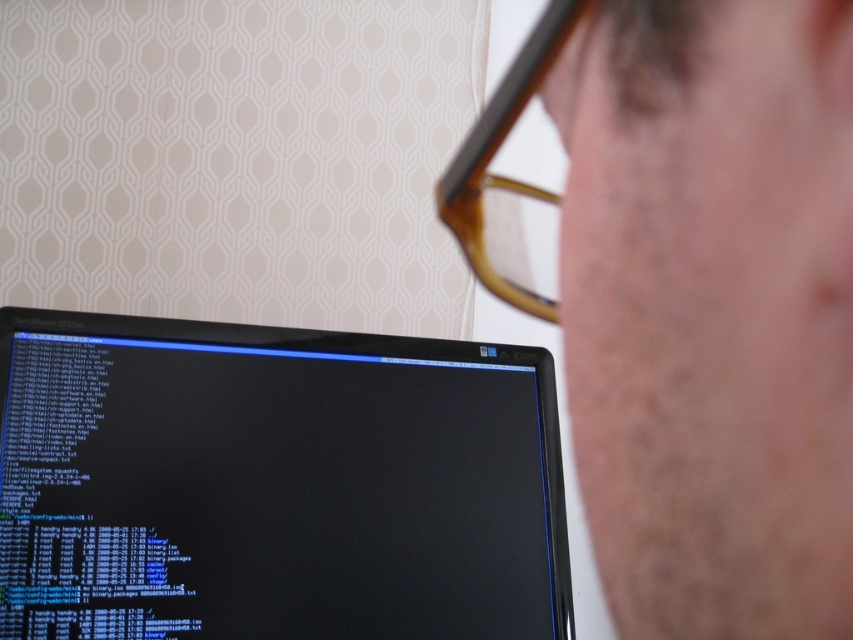
Question: Can you confirm if matte skin at center is positioned below black glossy monitor at center?

Choices:
 (A) no
 (B) yes

Answer: (A)

Question: Does black glossy monitor at center appear on the right side of brown tortoiseshell glasses at upper center?

Choices:
 (A) no
 (B) yes

Answer: (A)

Question: Among these objects, which one is farthest from the camera?

Choices:
 (A) black glossy monitor at center
 (B) matte skin at center
 (C) brown tortoiseshell glasses at upper center

Answer: (A)

Question: Does matte skin at center appear on the left side of black glossy monitor at center?

Choices:
 (A) no
 (B) yes

Answer: (A)

Question: Which point is farther from the camera taking this photo?

Choices:
 (A) (531, 305)
 (B) (540, 198)
 (C) (233, 557)

Answer: (C)

Question: Among these objects, which one is farthest from the camera?

Choices:
 (A) matte skin at center
 (B) black glossy monitor at center

Answer: (B)